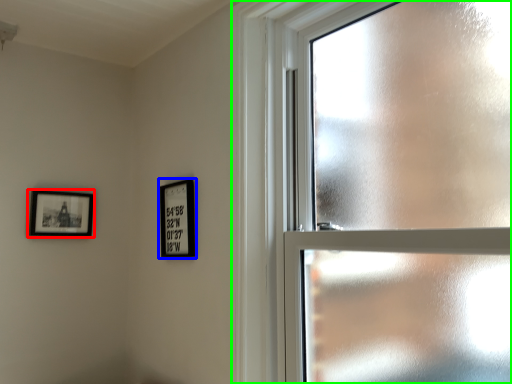
Question: Which object is the closest to the picture frame (highlighted by a red box)? Choose among these: picture frame (highlighted by a blue box) or window (highlighted by a green box).

Choices:
 (A) picture frame
 (B) window

Answer: (A)